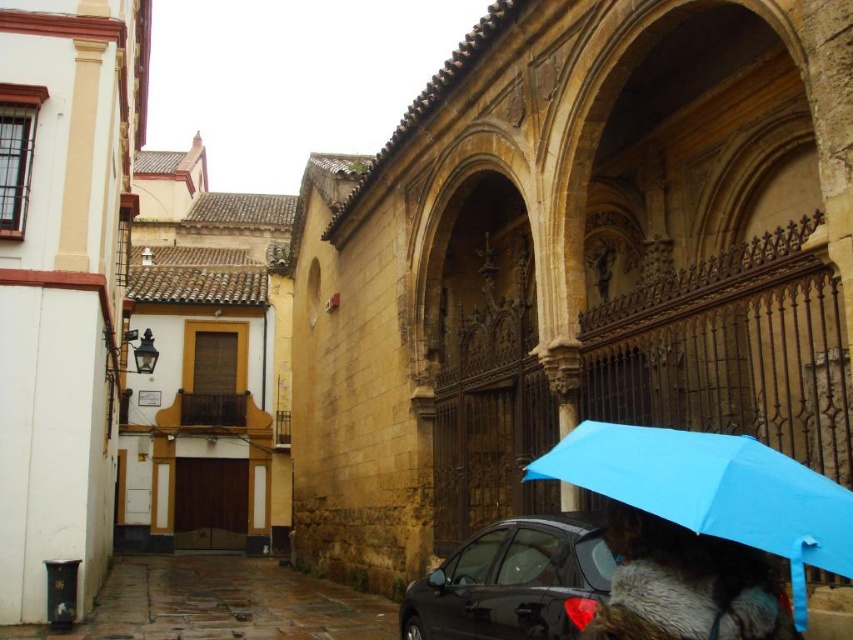
Question: Which object is closer to the camera taking this photo?

Choices:
 (A) glossy black car at lower center
 (B) blue matte umbrella at lower right

Answer: (B)

Question: Where is blue matte umbrella at lower right located in relation to fur coat at lower right in the image?

Choices:
 (A) left
 (B) right

Answer: (A)

Question: Is glossy black car at lower center to the right of fur coat at lower right from the viewer's perspective?

Choices:
 (A) yes
 (B) no

Answer: (B)

Question: Among these objects, which one is farthest from the camera?

Choices:
 (A) glossy black car at lower center
 (B) blue matte umbrella at lower right

Answer: (A)

Question: Among these points, which one is nearest to the camera?

Choices:
 (A) [x=608, y=445]
 (B) [x=572, y=550]
 (C) [x=610, y=525]

Answer: (A)

Question: Is blue matte umbrella at lower right to the right of fur coat at lower right from the viewer's perspective?

Choices:
 (A) yes
 (B) no

Answer: (B)